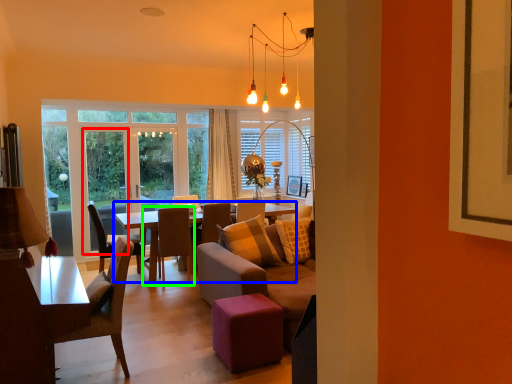
Question: Which object is positioned farthest from screen door (highlighted by a red box)? Select from coffee table (highlighted by a blue box) and chair (highlighted by a green box).

Choices:
 (A) coffee table
 (B) chair

Answer: (B)